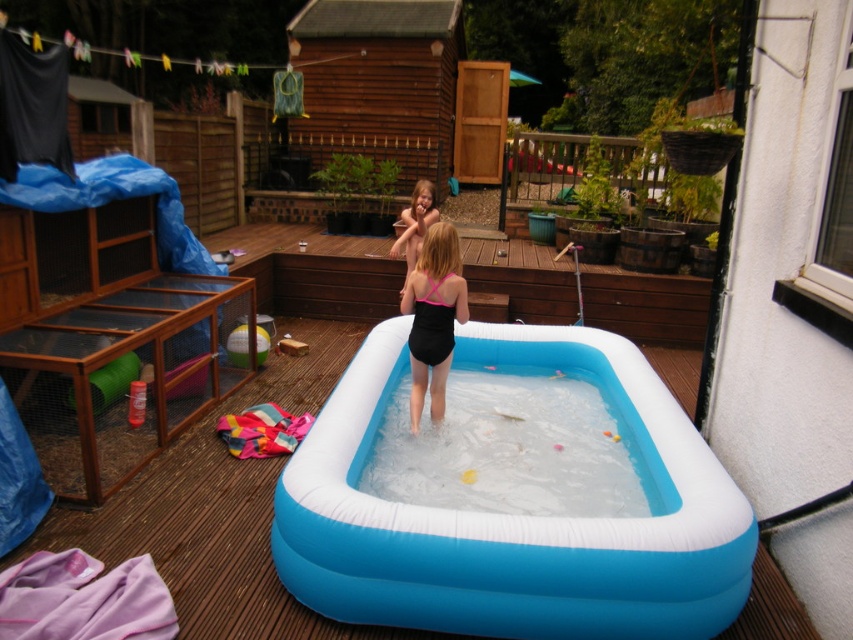
You are a photographer trying to capture a photo of the two points in the backyard scene. Which point, point (439, 365) or point (410, 209), will appear larger in the photo?

Point (439, 365) will appear larger in the photo because it is closer to the camera than point (410, 209).

You are a parent trying to ensure the safety of your children in the backyard. The blue inflatable pool at center is 2.42 meters away from the pink matte swimsuit at center. Given that the recommended safety distance between a pool and any loose items is at least 3 meters, is the current setup compliant with safety guidelines?

The blue inflatable pool at center is only 2.42 meters away from the pink matte swimsuit at center, which is less than the recommended 3 meters. Therefore, the current setup does not comply with safety guidelines.

You are a drone operator trying to capture a photo of the blue inflatable pool at center from above. The drone has a camera with a 120 degree field of view. The drone is currently at coordinates point A, which is at point A coordinates are at point A coordinates are at point A coordinates are at point A coordinates are at point A coordinates are at point A coordinates are at point A coordinates are at point A coordinates are at point A coordinates are at point A coordinates are at point A coordinates are at

The question contains an error with repeated mentions of point A coordinates. Please provide the exact coordinates of point A to determine if the blue inflatable pool at center is within the drone camera field of view.